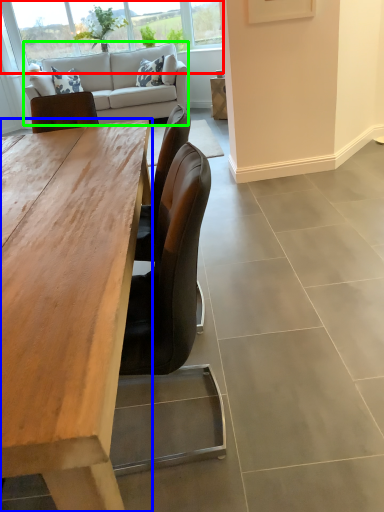
Question: Which is farther away from window (highlighted by a red box)? desk (highlighted by a blue box) or studio couch (highlighted by a green box)?

Choices:
 (A) desk
 (B) studio couch

Answer: (A)